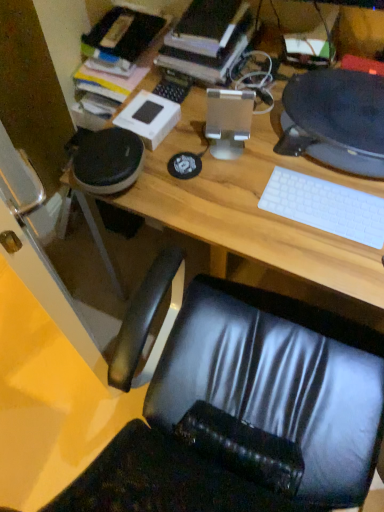
The image size is (384, 512). I want to click on vacant area on top of wooden desk at center (from a real-world perspective), so click(278, 157).